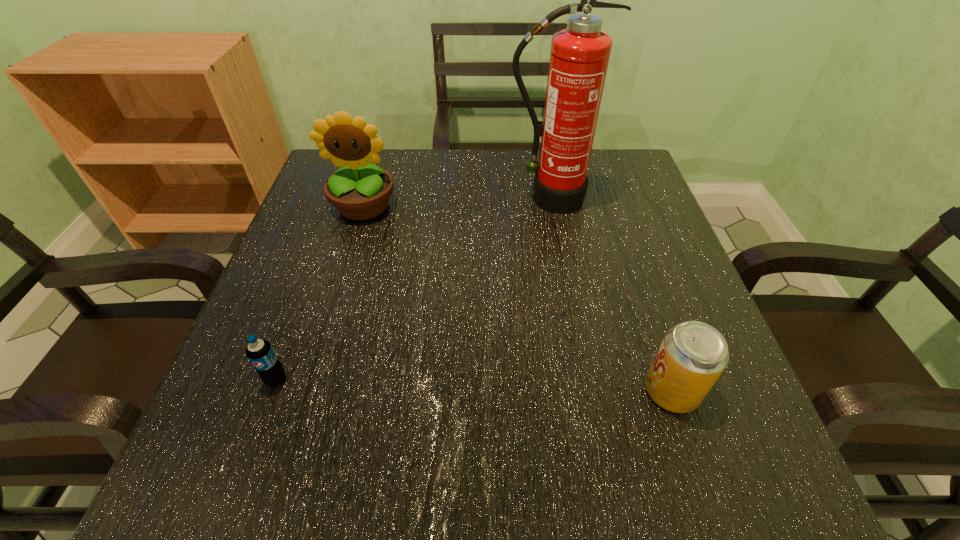
This screenshot has width=960, height=540. Find the location of `free space between the taller soda bottle and the fire extinguisher`. free space between the taller soda bottle and the fire extinguisher is located at coordinates (610, 295).

This screenshot has width=960, height=540. Find the location of `vacant space that is in between the fire extinguisher and the sunflower`. vacant space that is in between the fire extinguisher and the sunflower is located at coordinates (456, 202).

This screenshot has height=540, width=960. In order to click on vacant region between the left soda bottle and the third shortest object in this screenshot , I will do `click(320, 293)`.

This screenshot has height=540, width=960. Find the location of `free space between the sunflower and the shortest object`. free space between the sunflower and the shortest object is located at coordinates (320, 293).

Select which object is the closest to the right soda bottle. Please provide its 2D coordinates. Your answer should be formatted as a tuple, i.e. [(x, y)], where the tuple contains the x and y coordinates of a point satisfying the conditions above.

[(579, 57)]

In order to click on object that is the nearest to the left soda bottle in this screenshot , I will do click(362, 192).

This screenshot has height=540, width=960. What are the coordinates of `vacant region that satisfies the following two spatial constraints: 1. on the face of the second shortest object; 2. on the left side of the second tallest object` in the screenshot? It's located at pyautogui.click(x=307, y=391).

The image size is (960, 540). I want to click on free space that satisfies the following two spatial constraints: 1. on the front-facing side of the right soda bottle; 2. on the left side of the tallest object, so click(x=584, y=391).

Where is `free space that satisfies the following two spatial constraints: 1. on the face of the second tallest object; 2. on the right side of the right soda bottle`? The width and height of the screenshot is (960, 540). free space that satisfies the following two spatial constraints: 1. on the face of the second tallest object; 2. on the right side of the right soda bottle is located at coordinates (307, 391).

You are a GUI agent. You are given a task and a screenshot of the screen. Output one action in this format:
    pyautogui.click(x=<x>, y=<y>)
    Task: Click on the vacant space that satisfies the following two spatial constraints: 1. on the face of the taller soda bottle; 2. on the left side of the sunflower
    
    Given the screenshot: What is the action you would take?
    pyautogui.click(x=307, y=391)